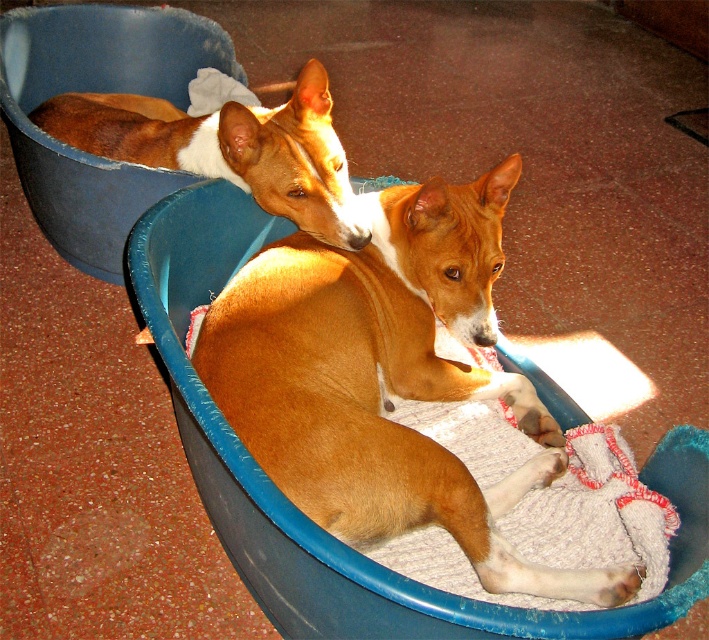
You are a veterinarian examining two dogs in a clinic. The dogs are the brown furry dog at center and the brown smooth dog at upper left. Based on their appearances, which dog might have a higher risk of joint issues due to body shape?

The brown furry dog at center has a thinner build compared to the brown smooth dog at upper left. Thinner dogs may have less muscle mass and body fat, potentially increasing the risk of joint stress and related issues.

Consider the image. There are two dogs in a blue plastic tub on a terracotta floor. The dogs are positioned at point (359, 416). If you want to place a toy between them so that it is exactly halfway between the two dogs, where should you place it?

The toy should be placed exactly halfway between the two dogs at point (359, 416) since they are 4.07 feet apart.